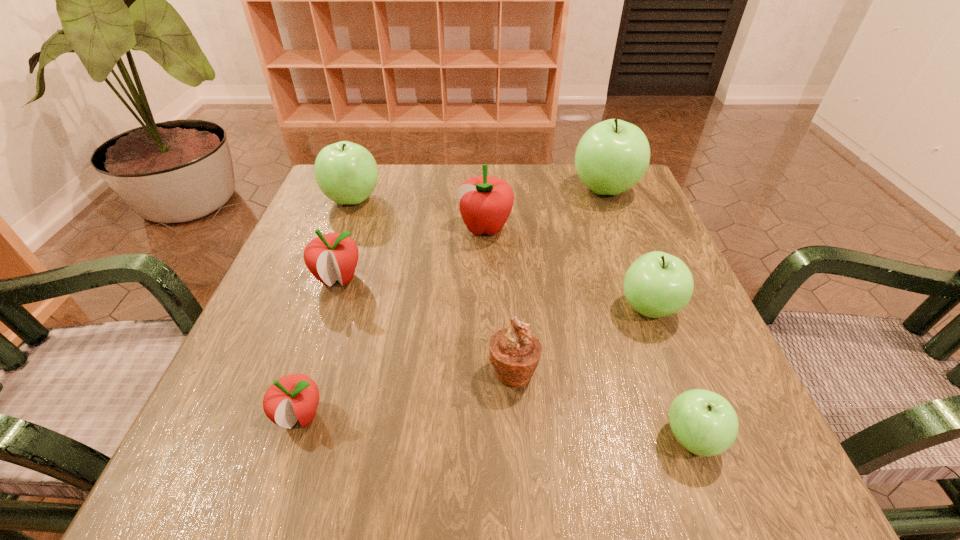
Find the location of a particular element. The height and width of the screenshot is (540, 960). the tallest object is located at coordinates (612, 156).

You are a GUI agent. You are given a task and a screenshot of the screen. Output one action in this format:
    pyautogui.click(x=<x>, y=<y>)
    Task: Click on the biggest green apple
    The width and height of the screenshot is (960, 540).
    Given the screenshot: What is the action you would take?
    pyautogui.click(x=612, y=156)

Identify the location of the fourth apple from left to right. (485, 202).

I want to click on the rightmost red apple, so click(x=485, y=202).

The width and height of the screenshot is (960, 540). I want to click on the second biggest green apple, so click(347, 173).

Where is `the third biggest green apple`? the third biggest green apple is located at coordinates (657, 284).

You are a GUI agent. You are given a task and a screenshot of the screen. Output one action in this format:
    pyautogui.click(x=<x>, y=<y>)
    Task: Click on the second smallest red apple
    
    Given the screenshot: What is the action you would take?
    pyautogui.click(x=329, y=257)

Where is `the third nearest object`? The height and width of the screenshot is (540, 960). the third nearest object is located at coordinates (515, 352).

Where is `the smallest red apple`? The image size is (960, 540). the smallest red apple is located at coordinates (295, 397).

Where is `the nearest green apple`? the nearest green apple is located at coordinates (703, 422).